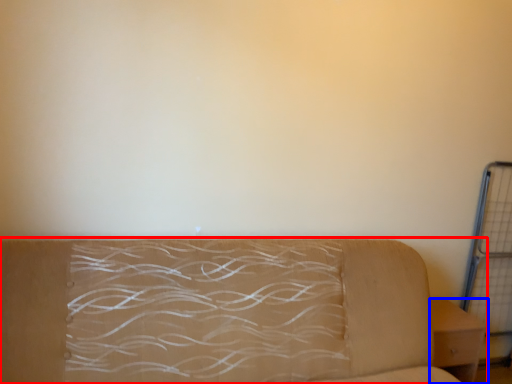
Question: Among these objects, which one is nearest to the camera, studio couch (highlighted by a red box) or furniture (highlighted by a blue box)?

Choices:
 (A) studio couch
 (B) furniture

Answer: (A)